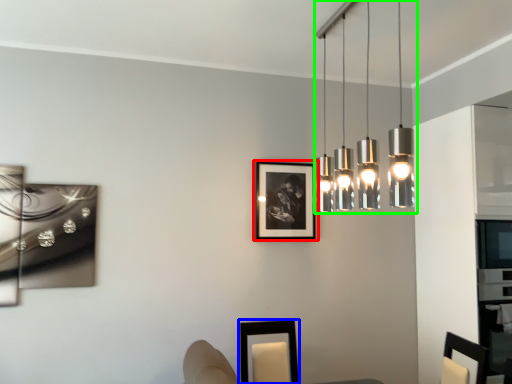
Question: Which object is the farthest from picture frame (highlighted by a red box)? Choose among these: picture frame (highlighted by a blue box) or lamp (highlighted by a green box).

Choices:
 (A) picture frame
 (B) lamp

Answer: (B)